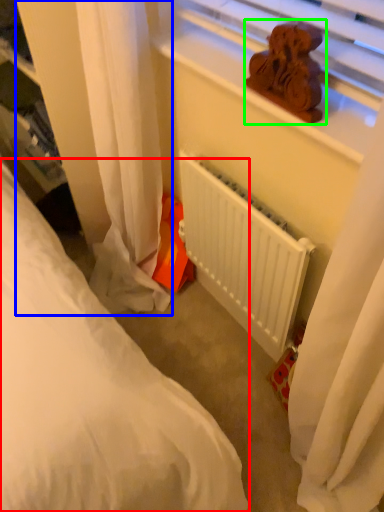
Question: Which is nearer to the bed (highlighted by a red box)? curtain (highlighted by a blue box) or miniature (highlighted by a green box).

Choices:
 (A) curtain
 (B) miniature

Answer: (A)